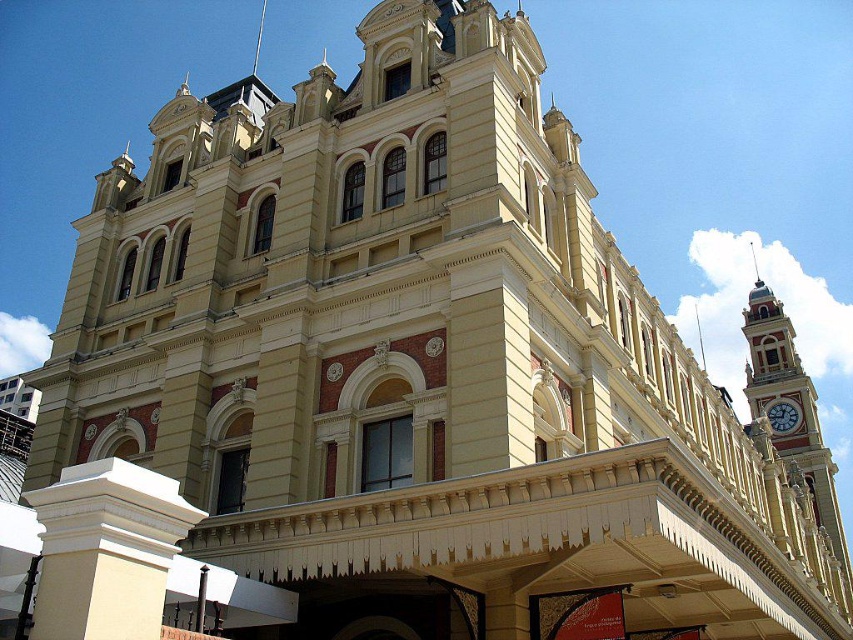
You are standing in front of the grand building and notice two points marked on its facade. The first point is at coordinates point (x=183, y=532) and the second is at point (x=839, y=531). Which of these points is closer to you?

Point (x=183, y=532) is closer to the viewer than point (x=839, y=531).

You are standing in front of the grand building and notice a point marked at coordinate (795, 401). Based on the building description, what architectural feature is located at this point?

The point at coordinate (795, 401) indicates the gold painted metal clock tower at right.

You are standing at the base of the white smooth pillar at lower left and want to take a photo of the grand building. If your camera has a maximum focus range of 80 feet, will you be able to capture the entire building in one shot?

The distance between the white smooth pillar at lower left and the camera is 81.36 feet. Since the camera can only focus up to 80 feet, you won mentioned the camera is at the pillar or elsewhere? Wait the question says you are standing at the pillar, so the camera is there. The building is the subject. The distance from the pillar to the camera is 81.36 feet? That would mean the building is 81.36 feet away from the pillar. But if the camera is at the pillar, then the distance to the building would be zero.